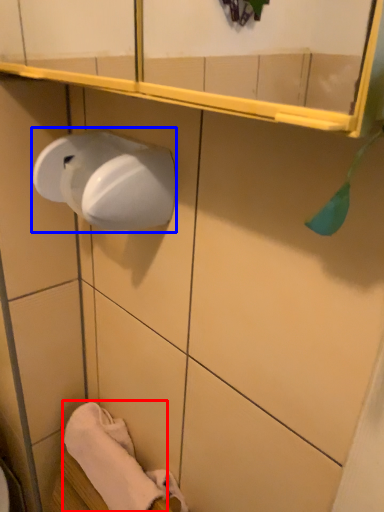
Question: Which of the following is the closest to the observer, bath towel (highlighted by a red box) or paper towel (highlighted by a blue box)?

Choices:
 (A) bath towel
 (B) paper towel

Answer: (B)